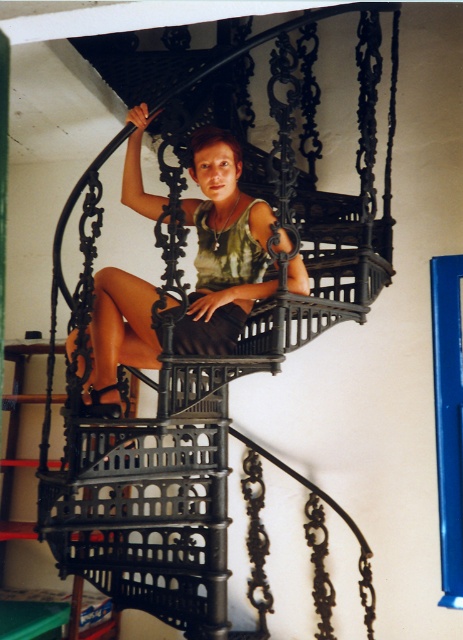
Is point (216, 163) closer to camera compared to point (176, 323)?

No, (216, 163) is behind (176, 323).

From the picture: Is matte green tank top at center bigger than green matte dress at center?

Correct, matte green tank top at center is larger in size than green matte dress at center.

The height and width of the screenshot is (640, 463). What are the coordinates of `matte green tank top at center` in the screenshot? It's located at (224, 244).

Locate an element on the screen. matte green tank top at center is located at coordinates (224, 244).